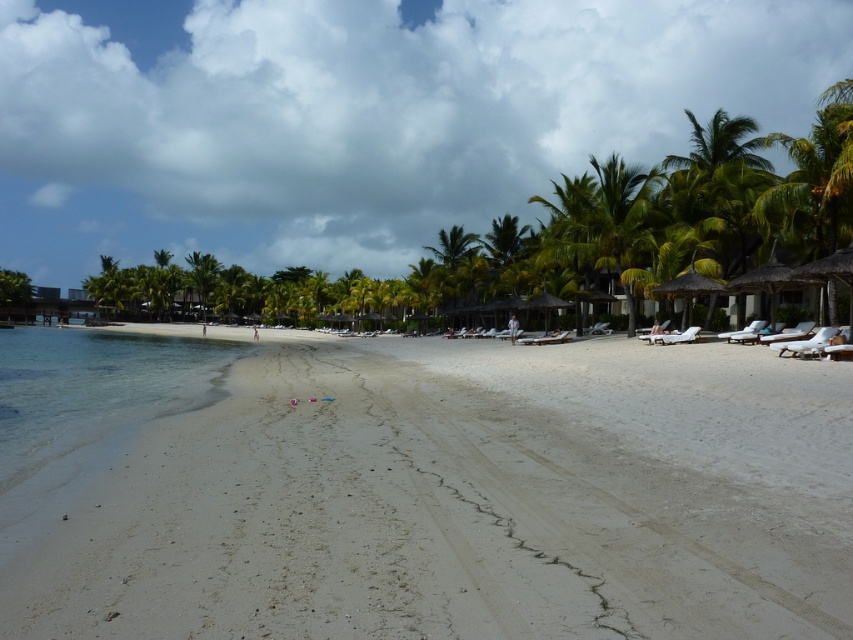
You are standing on the white sandy beach at center and want to reach the clear water at lower left. Which direction should you walk to get there?

You should walk towards the lower left direction from the white sandy beach at center to reach the clear water at lower left.

You are standing at the center of the beach and want to locate the white sandy beach at center. According to the coordinates provided, in which direction should you move to reach it?

The white sandy beach at center is already at the center point, so you don not need to move in any direction to reach it.